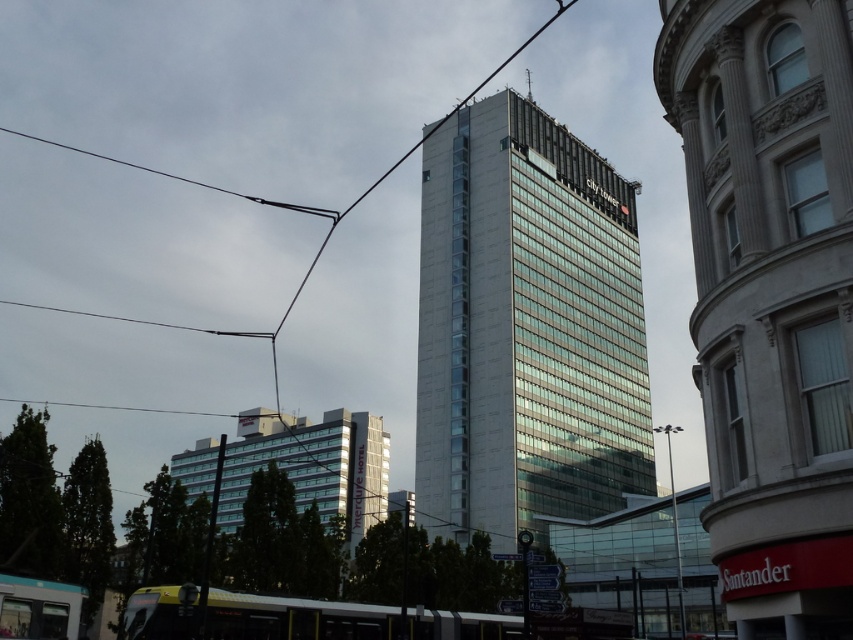
Question: Can you confirm if matte glass building at center is bigger than black wire at upper left?

Choices:
 (A) yes
 (B) no

Answer: (B)

Question: Estimate the real-world distances between objects in this image. Which object is farther from the matte glass building at center?

Choices:
 (A) black wire at upper left
 (B) metallic silver bus at lower center

Answer: (A)

Question: Can you confirm if matte glass building at center is positioned to the right of black wire at upper left?

Choices:
 (A) no
 (B) yes

Answer: (B)

Question: Which of the following is the closest to the observer?

Choices:
 (A) black wire at upper left
 (B) matte glass building at center

Answer: (B)

Question: Is metallic silver bus at lower center closer to camera compared to black wire at upper left?

Choices:
 (A) yes
 (B) no

Answer: (A)

Question: Which object appears farthest from the camera in this image?

Choices:
 (A) metallic silver bus at lower center
 (B) black wire at upper left
 (C) matte glass building at center

Answer: (B)